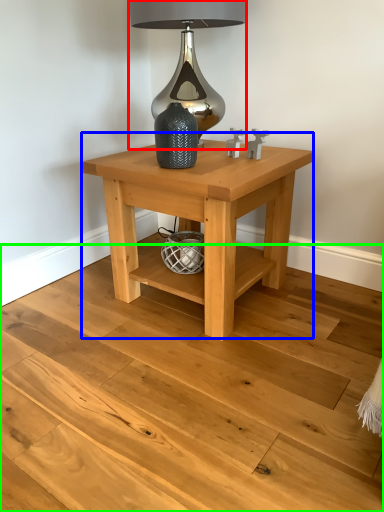
Question: Estimate the real-world distances between objects in this image. Which object is closer to table lamp (highlighted by a red box), table (highlighted by a blue box) or stair (highlighted by a green box)?

Choices:
 (A) table
 (B) stair

Answer: (A)